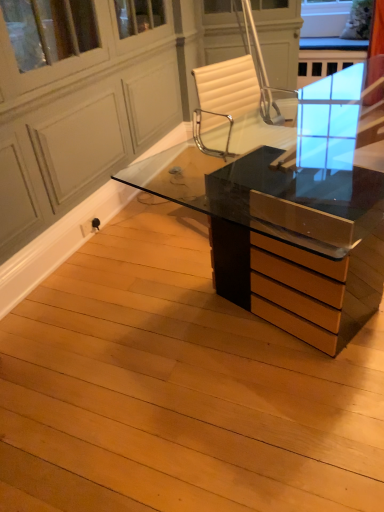
At what (x,y) coordinates should I click in order to perform the action: click on vacant space positioned to the left of matte black desk at center. Please return your answer as a coordinate pair (x, y). Image resolution: width=384 pixels, height=512 pixels. Looking at the image, I should click on (153, 283).